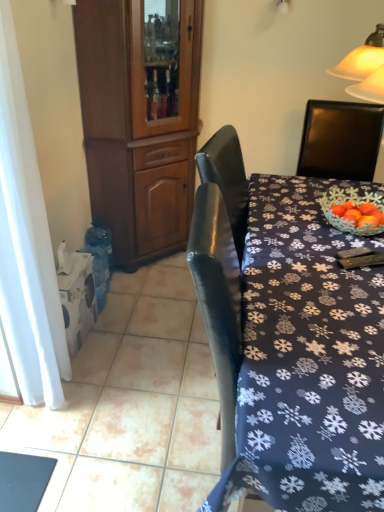
What is the approximate height of brown wood cabinet at left?

It is 1.52 meters.

Describe the element at coordinates (139, 124) in the screenshot. I see `brown wood cabinet at left` at that location.

The width and height of the screenshot is (384, 512). I want to click on white sheer curtain at left, so click(x=26, y=243).

Do you think dark blue fabric tablecloth at center is within white sheer curtain at left, or outside of it?

dark blue fabric tablecloth at center is not enclosed by white sheer curtain at left.

Which is in front, point (366, 475) or point (12, 54)?

The point (366, 475) is closer.

Is dark blue fabric tablecloth at center positioned behind white sheer curtain at left?

No, dark blue fabric tablecloth at center is closer to the viewer.

Which of these two, dark blue fabric tablecloth at center or white sheer curtain at left, stands taller?

white sheer curtain at left.

Can you confirm if dark blue fabric tablecloth at center is thinner than brown wood cabinet at left?

No.

Does dark blue fabric tablecloth at center turn towards brown wood cabinet at left?

No, dark blue fabric tablecloth at center is not turned towards brown wood cabinet at left.

Considering the positions of objects dark blue fabric tablecloth at center and brown wood cabinet at left in the image provided, who is more to the right, dark blue fabric tablecloth at center or brown wood cabinet at left?

dark blue fabric tablecloth at center is more to the right.

In the scene shown: Between dark blue fabric tablecloth at center and brown wood cabinet at left, which one has smaller size?

dark blue fabric tablecloth at center.

Can you confirm if brown wood cabinet at left is thinner than dark blue fabric tablecloth at center?

Correct, the width of brown wood cabinet at left is less than that of dark blue fabric tablecloth at center.

How much distance is there between brown wood cabinet at left and dark blue fabric tablecloth at center?

brown wood cabinet at left and dark blue fabric tablecloth at center are 1.15 meters apart.

Is brown wood cabinet at left beside dark blue fabric tablecloth at center?

There is a gap between brown wood cabinet at left and dark blue fabric tablecloth at center.

Based on the photo, which of these two, brown wood cabinet at left or dark blue fabric tablecloth at center, stands shorter?

dark blue fabric tablecloth at center.

Is point (195, 125) closer or farther from the camera than point (62, 370)?

Point (195, 125) is positioned farther from the camera compared to point (62, 370).

Is brown wood cabinet at left positioned before white sheer curtain at left?

No, brown wood cabinet at left is further to the viewer.

Who is shorter, brown wood cabinet at left or white sheer curtain at left?

Standing shorter between the two is white sheer curtain at left.

Consider the image. In the image, is brown wood cabinet at left on the left side or the right side of white sheer curtain at left?

In the image, brown wood cabinet at left appears on the right side of white sheer curtain at left.

Consider the image. From the image's perspective, is white sheer curtain at left above brown wood cabinet at left?

No, from the image's perspective, white sheer curtain at left is not above brown wood cabinet at left.

Is white sheer curtain at left far from brown wood cabinet at left?

Yes, white sheer curtain at left is far from brown wood cabinet at left.

Visually, is white sheer curtain at left positioned to the left or to the right of brown wood cabinet at left?

Based on their positions, white sheer curtain at left is located to the left of brown wood cabinet at left.

Is point (25, 175) farther from viewer compared to point (183, 170)?

No, (25, 175) is in front of (183, 170).

Based on the photo, is white sheer curtain at left turned away from dark blue fabric tablecloth at center?

No, white sheer curtain at left's orientation is not away from dark blue fabric tablecloth at center.

Does white sheer curtain at left have a larger size compared to dark blue fabric tablecloth at center?

Incorrect, white sheer curtain at left is not larger than dark blue fabric tablecloth at center.

Does white sheer curtain at left have a lesser width compared to dark blue fabric tablecloth at center?

Yes.

Where is `desk below the white sheer curtain at left (from the image's perspective)`? This screenshot has width=384, height=512. desk below the white sheer curtain at left (from the image's perspective) is located at coordinates coord(298,356).

I want to click on desk that is in front of the brown wood cabinet at left, so click(298, 356).

Looking at the image, which one is located closer to white sheer curtain at left, brown wood cabinet at left or dark blue fabric tablecloth at center?

Based on the image, dark blue fabric tablecloth at center appears to be nearer to white sheer curtain at left.

Estimate the real-world distances between objects in this image. Which object is closer to dark blue fabric tablecloth at center, white sheer curtain at left or brown wood cabinet at left?

Based on the image, white sheer curtain at left appears to be nearer to dark blue fabric tablecloth at center.

From the image, which object appears to be nearer to brown wood cabinet at left, dark blue fabric tablecloth at center or white sheer curtain at left?

The object closer to brown wood cabinet at left is white sheer curtain at left.

When comparing their distances from white sheer curtain at left, does dark blue fabric tablecloth at center or brown wood cabinet at left seem further?

brown wood cabinet at left is further to white sheer curtain at left.

Estimate the real-world distances between objects in this image. Which object is closer to brown wood cabinet at left, white sheer curtain at left or dark blue fabric tablecloth at center?

white sheer curtain at left is closer to brown wood cabinet at left.

Estimate the real-world distances between objects in this image. Which object is further from dark blue fabric tablecloth at center, brown wood cabinet at left or white sheer curtain at left?

Based on the image, brown wood cabinet at left appears to be further to dark blue fabric tablecloth at center.

Image resolution: width=384 pixels, height=512 pixels. In order to click on curtain between brown wood cabinet at left and dark blue fabric tablecloth at center vertically in this screenshot , I will do 26,243.